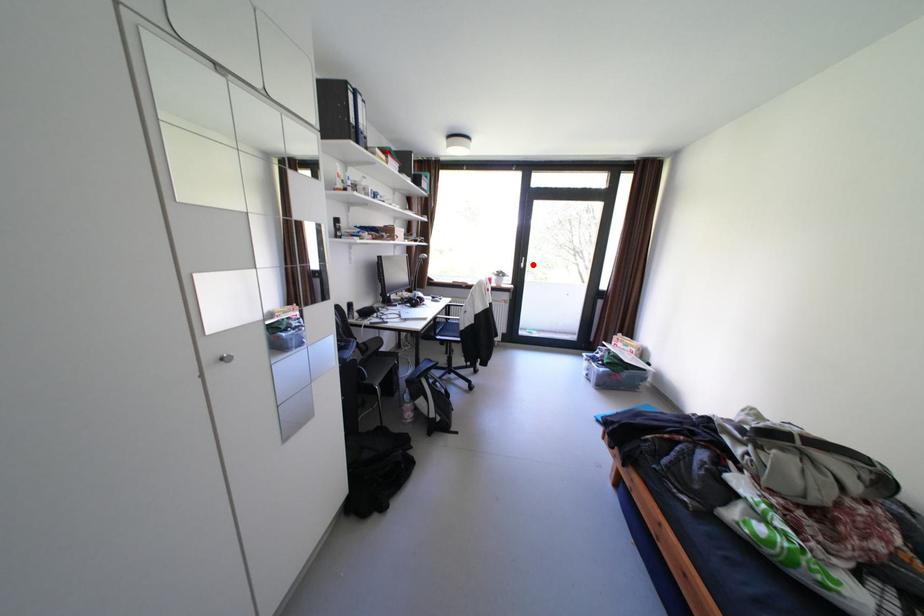
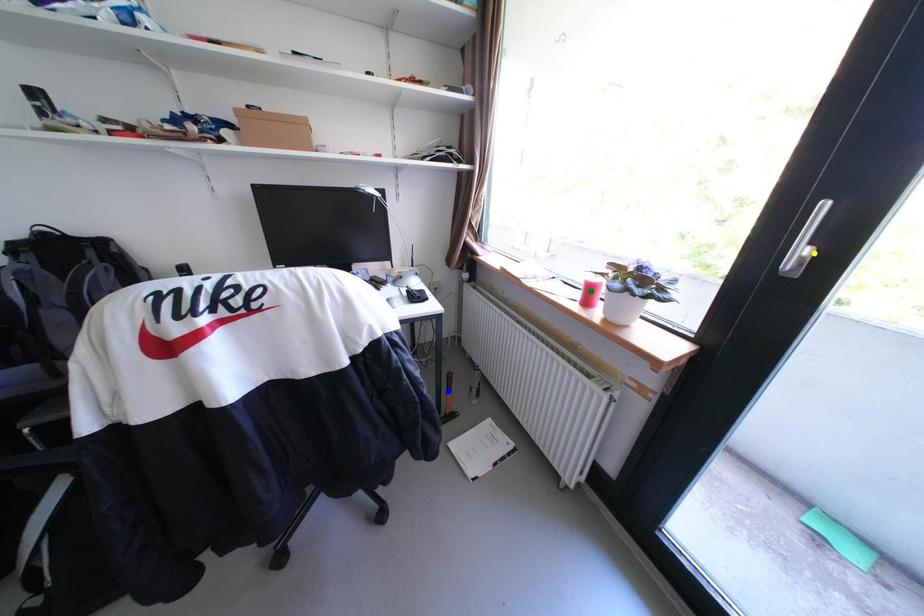
Question: I am providing you with two images of the same scene from different viewpoints. A red point is marked on the first image. You are given multiple points on the second image. Which spot in image 2 lines up with the point in image 1?

Choices:
 (A) yellow point
 (B) green point
 (C) blue point

Answer: (A)